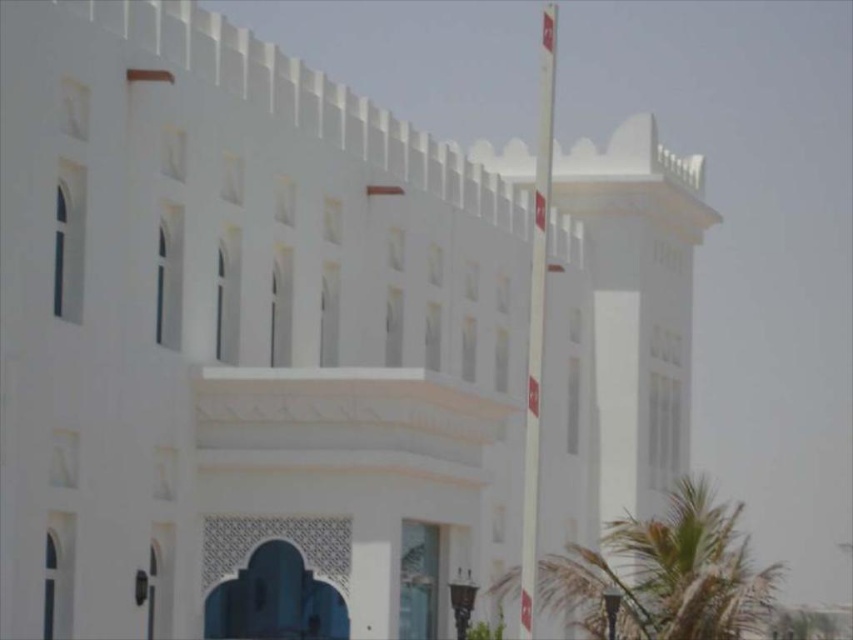
Question: Which point is farther from the camera taking this photo?

Choices:
 (A) (550, 572)
 (B) (531, 513)

Answer: (A)

Question: Is green leafy palm tree at lower right smaller than white plastic flag pole at right?

Choices:
 (A) yes
 (B) no

Answer: (A)

Question: In this image, where is green leafy palm tree at lower right located relative to white plastic flag pole at right?

Choices:
 (A) left
 (B) right

Answer: (B)

Question: Is green leafy palm tree at lower right wider than white plastic flag pole at right?

Choices:
 (A) no
 (B) yes

Answer: (B)

Question: Which of the following is the closest to the observer?

Choices:
 (A) green leafy palm tree at lower right
 (B) white plastic flag pole at right

Answer: (B)